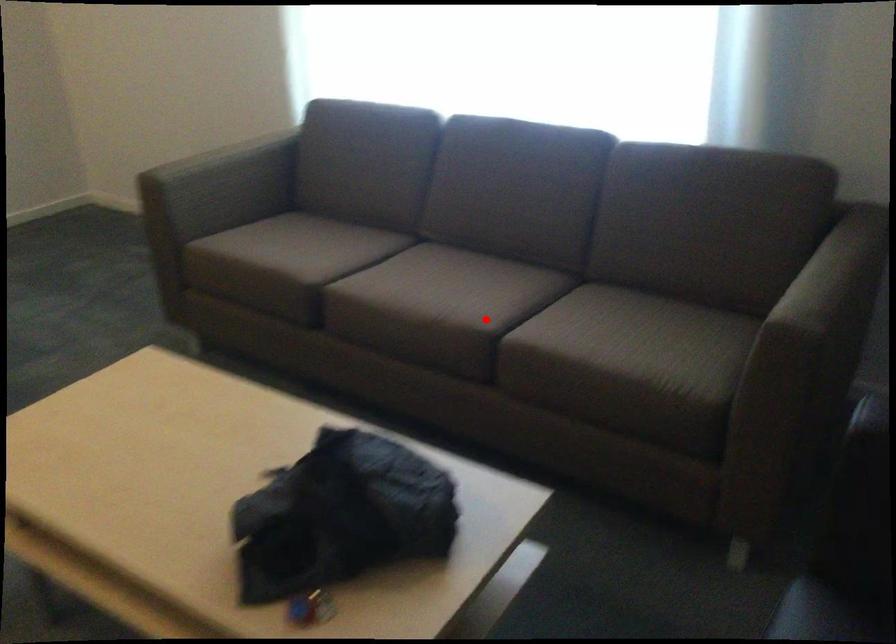
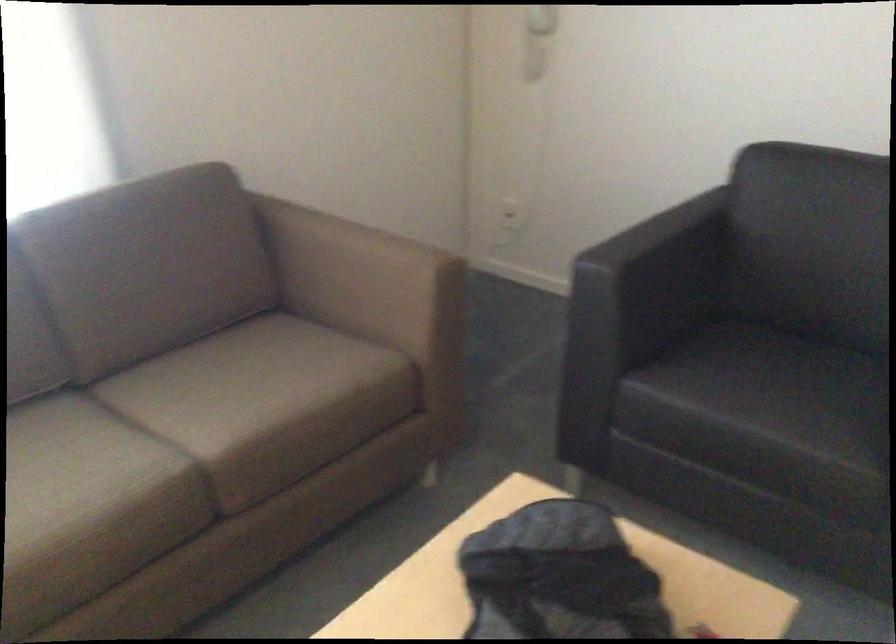
Question: A red point is marked in image1. In image2, is the corresponding 3D point closer to the camera or farther? Reply with the corresponding letter.

Choices:
 (A) The corresponding 3D point is closer.
 (B) The corresponding 3D point is farther.

Answer: (A)